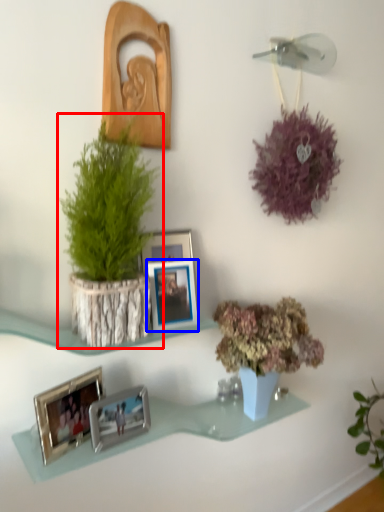
Question: Which object is closer to the camera taking this photo, houseplant (highlighted by a red box) or picture frame (highlighted by a blue box)?

Choices:
 (A) houseplant
 (B) picture frame

Answer: (A)